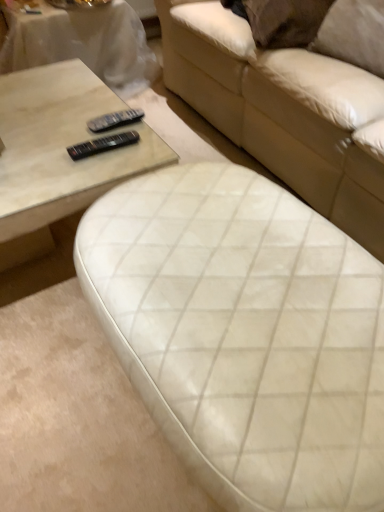
The image size is (384, 512). Find the location of `empty space that is ontop of white quilted leather ottoman at center, the 1th studio couch in the bottom-to-top sequence`. empty space that is ontop of white quilted leather ottoman at center, the 1th studio couch in the bottom-to-top sequence is located at coordinates (240, 284).